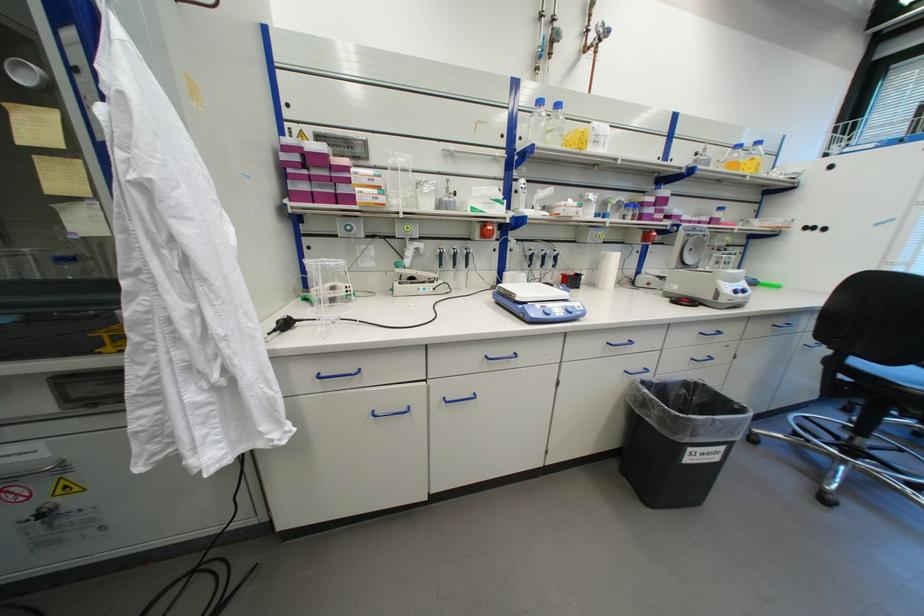
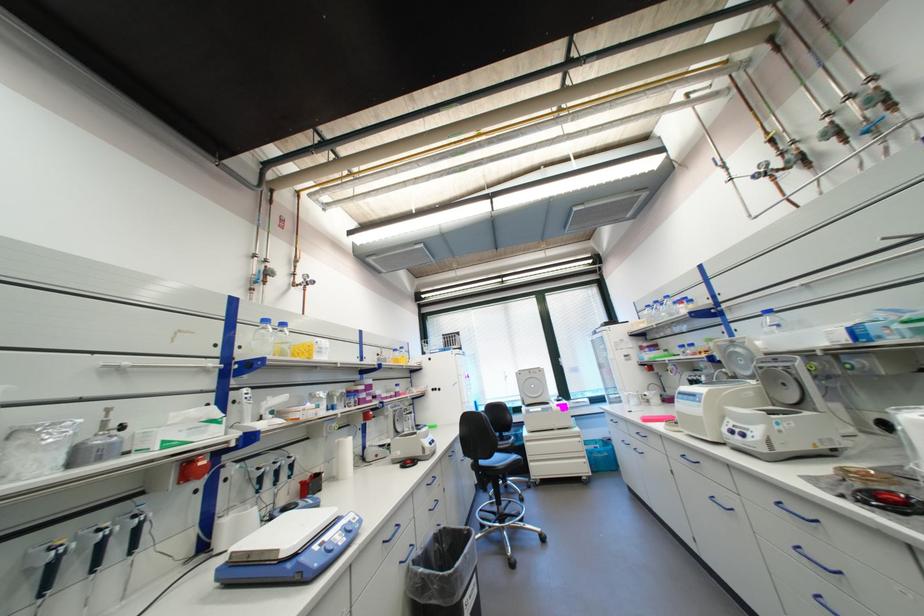
In the second image, find the point that corresponds to [545,306] in the first image.

(323, 548)